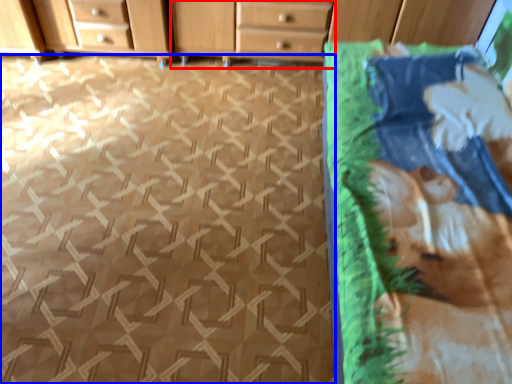
Question: Which point is further to the camera, chest of drawers (highlighted by a red box) or tile (highlighted by a blue box)?

Choices:
 (A) chest of drawers
 (B) tile

Answer: (A)